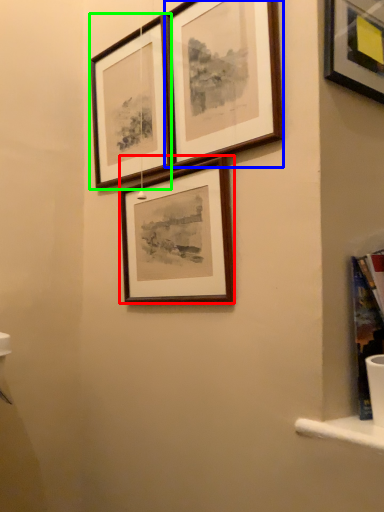
Question: Which object is positioned closest to picture frame (highlighted by a red box)? Select from picture frame (highlighted by a blue box) and picture frame (highlighted by a green box).

Choices:
 (A) picture frame
 (B) picture frame

Answer: (A)